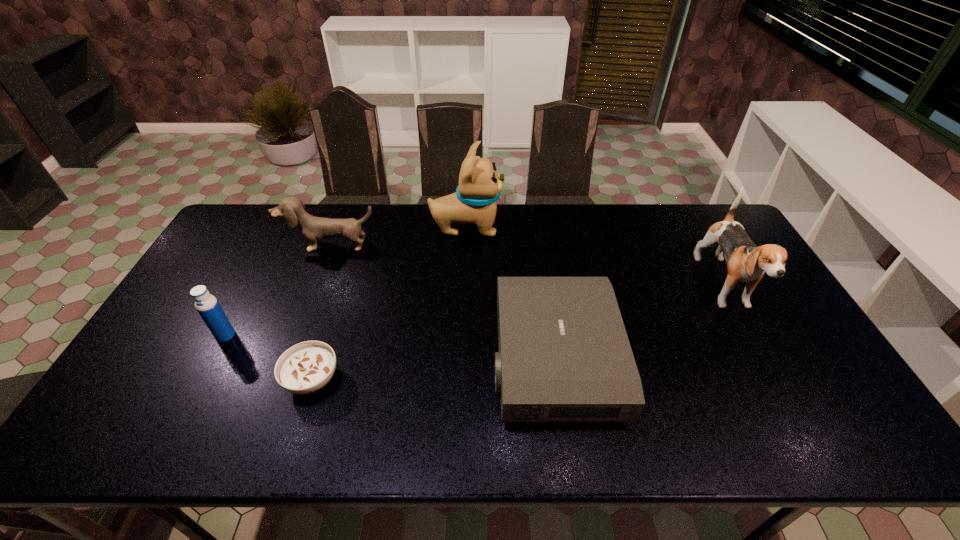
Where is `vacant point located 0.150m on the front-facing side of the projector`? The image size is (960, 540). vacant point located 0.150m on the front-facing side of the projector is located at coordinates (437, 359).

What are the coordinates of `vacant area located on the front-facing side of the projector` in the screenshot? It's located at (357, 359).

The width and height of the screenshot is (960, 540). I want to click on vacant space located 0.340m on the front-facing side of the projector, so click(365, 359).

Locate an element on the screen. The width and height of the screenshot is (960, 540). free spot located 0.130m on the right of the soup bowl is located at coordinates (393, 380).

At what (x,y) coordinates should I click in order to perform the action: click on object located in the near edge section of the desktop. Please return your answer as a coordinate pair (x, y). The image size is (960, 540). Looking at the image, I should click on (564, 355).

Find the location of a particular element. object at the right edge is located at coordinates (746, 262).

Where is `vacant space at the far edge`? The height and width of the screenshot is (540, 960). vacant space at the far edge is located at coordinates (584, 229).

The image size is (960, 540). Identify the location of vacant space at the near edge of the desktop. pyautogui.click(x=382, y=420).

Locate an element on the screen. The height and width of the screenshot is (540, 960). blank space at the far left corner is located at coordinates (252, 223).

At what (x,y) coordinates should I click in order to perform the action: click on empty location between the leftmost object and the shortest object. Please return your answer as a coordinate pair (x, y). The image size is (960, 540). Looking at the image, I should click on (269, 357).